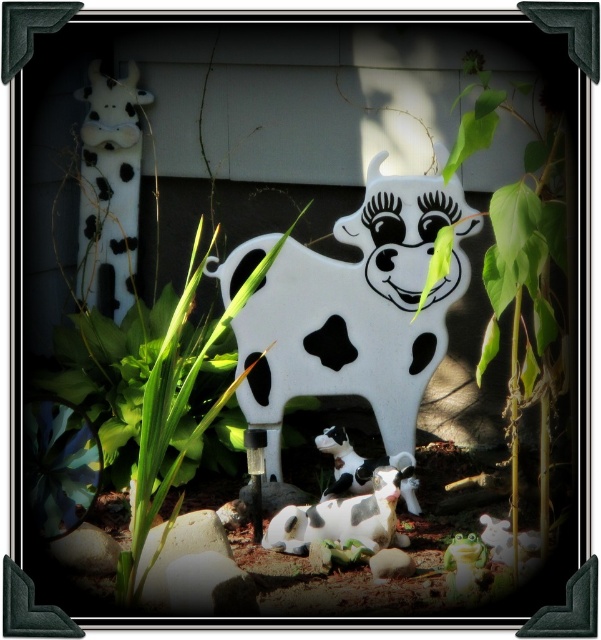
Is point (126, 592) positioned after point (343, 488)?

No, it is in front of (343, 488).

Who is positioned more to the left, green leafy plant at center or polka dot plastic cow at center?

Positioned to the left is green leafy plant at center.

The width and height of the screenshot is (601, 640). I want to click on green leafy plant at center, so click(177, 413).

Is black and white spotted cow at center shorter than white matte cow at lower center?

In fact, black and white spotted cow at center may be taller than white matte cow at lower center.

Is black and white spotted cow at center above white matte cow at lower center?

Correct, black and white spotted cow at center is located above white matte cow at lower center.

Locate an element on the screen. Image resolution: width=601 pixels, height=640 pixels. black and white spotted cow at center is located at coordinates (343, 518).

Identify the location of black and white spotted cow at center. The width and height of the screenshot is (601, 640). (343, 518).

Can you confirm if white plastic cow at center is positioned below polka dot plastic cow at center?

Incorrect, white plastic cow at center is not positioned below polka dot plastic cow at center.

Can you confirm if white plastic cow at center is shorter than polka dot plastic cow at center?

In fact, white plastic cow at center may be taller than polka dot plastic cow at center.

Between point (329, 394) and point (349, 458), which one is positioned in front?

Point (349, 458)

Locate an element on the screen. The width and height of the screenshot is (601, 640). white plastic cow at center is located at coordinates (356, 310).